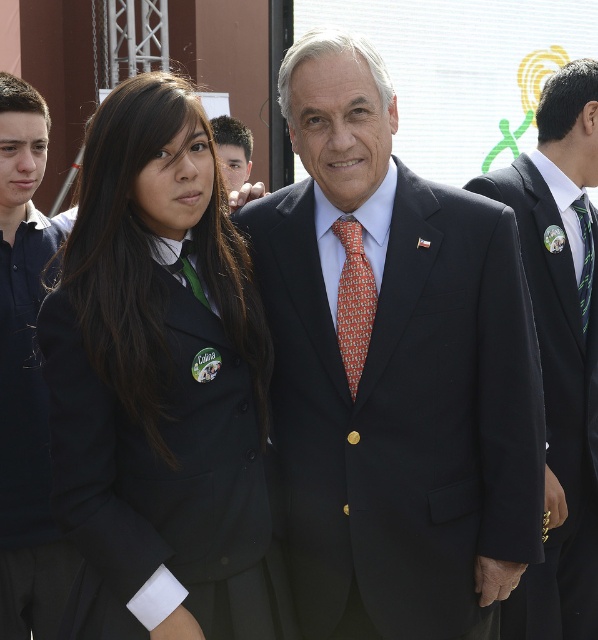
You are a tailor measuring the satin black suit at center and the orange printed tie at center for alterations. Which item requires a wider measurement for its current width?

The satin black suit at center requires a wider measurement because its width is larger than the orange printed tie at center.

You are a photographer setting up for a formal event. You need to ensure that the black fabric uniform at left and the matte black suit at left are both visible in the frame. Based on their positions, which one is covering part of the other?

The black fabric uniform at left is positioned over the matte black suit at left, meaning it is covering part of the matte black suit at left.

You are standing in the outdoor setting shown in the image. There is a point at coordinates point (182,211). Can you reach this point without moving your feet?

The point at coordinates point (182,211) is 3.89 meters away from the viewer, so you cannot reach it without moving your feet because it is too far.